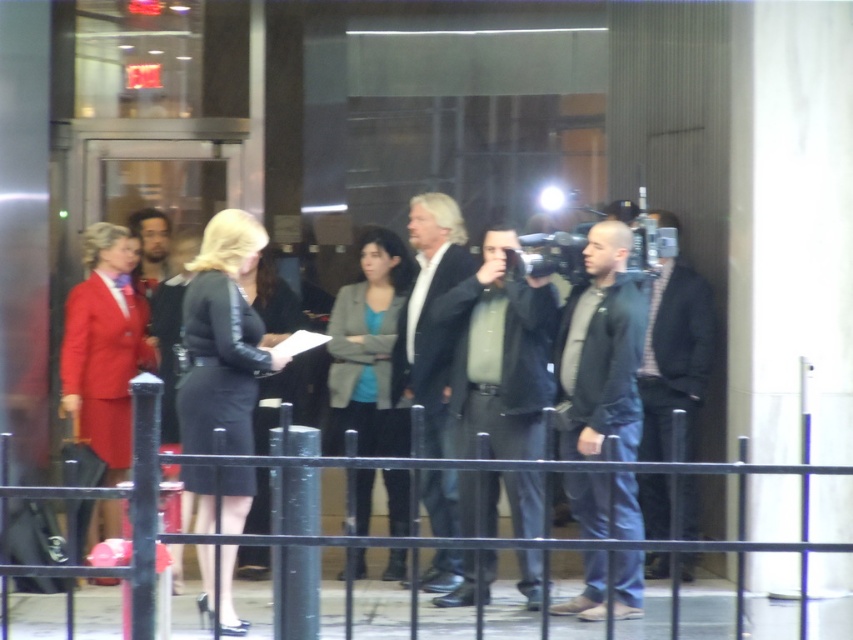
Is black metal fence at lower center below dark gray suit at center?

Indeed, black metal fence at lower center is positioned under dark gray suit at center.

Is black metal fence at lower center closer to the viewer compared to dark gray suit at center?

Yes, it is in front of dark gray suit at center.

Does point (770, 545) come behind point (670, 428)?

No, it is in front of (670, 428).

Image resolution: width=853 pixels, height=640 pixels. Find the location of `black metal fence at lower center`. black metal fence at lower center is located at coordinates (335, 536).

Between point (201, 344) and point (445, 524), which one is positioned behind?

The point (445, 524) is more distant.

Is point (202, 372) in front of point (437, 506)?

Yes.

Locate an element on the screen. This screenshot has width=853, height=640. black leather dress at center is located at coordinates (222, 337).

Can you confirm if dark gray hoodie at center is thinner than black leather jacket at center?

Answer: No.

Does dark gray hoodie at center come behind black leather jacket at center?

No, dark gray hoodie at center is closer to the viewer.

Who is more forward, (619, 401) or (445, 397)?

Positioned in front is point (619, 401).

Find the location of a particular element. dark gray hoodie at center is located at coordinates (601, 349).